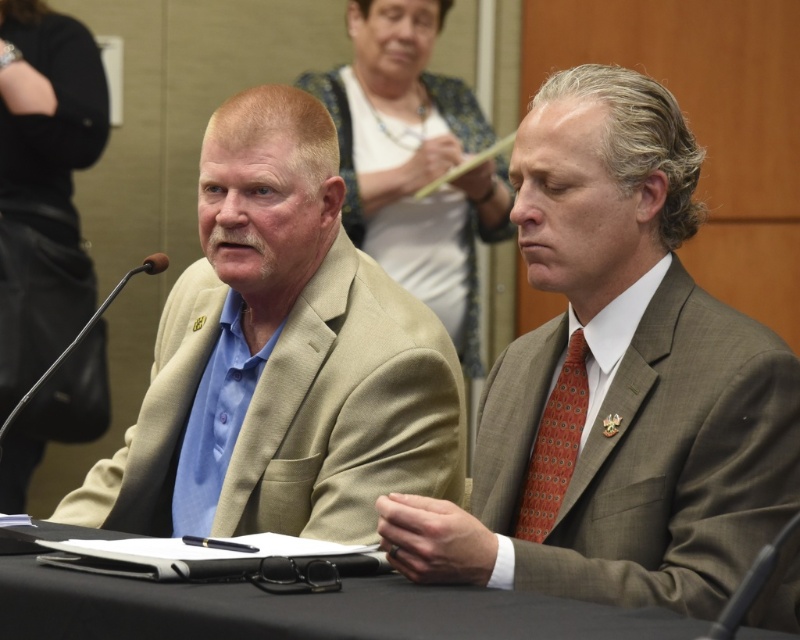
Question: Does beige fabric suit at left have a greater width compared to orange dotted tie at right?

Choices:
 (A) yes
 (B) no

Answer: (A)

Question: Which point appears closest to the camera in this image?

Choices:
 (A) (544, 444)
 (B) (582, 328)
 (C) (288, 605)
 (D) (332, 339)

Answer: (C)

Question: Does beige fabric suit at left appear on the right side of black fabric table at center?

Choices:
 (A) yes
 (B) no

Answer: (B)

Question: Which point is closer to the camera?

Choices:
 (A) (280, 170)
 (B) (732, 428)

Answer: (B)

Question: Is matte brown suit at center to the right of orange dotted tie at right from the viewer's perspective?

Choices:
 (A) yes
 (B) no

Answer: (A)

Question: Which of the following is the closest to the observer?

Choices:
 (A) (398, 580)
 (B) (770, 460)
 (C) (316, 308)
 (D) (576, 420)

Answer: (B)